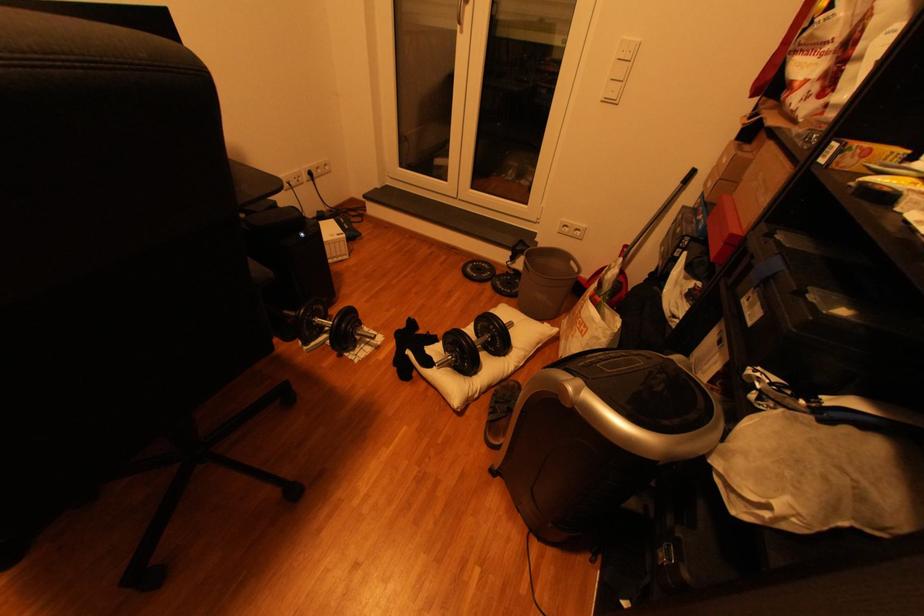
This screenshot has width=924, height=616. Find the location of `black chair armrest`. black chair armrest is located at coordinates (252, 184).